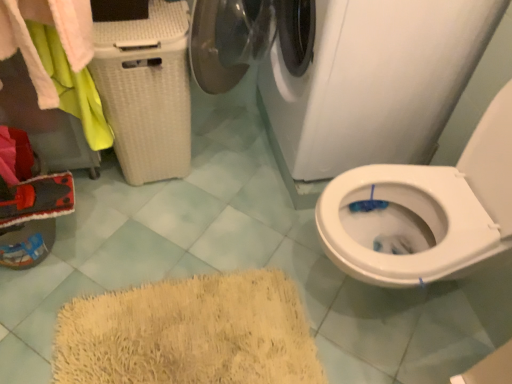
Question: From a real-world perspective, is white glossy washing machine at upper center physically below white wicker laundry basket at left?

Choices:
 (A) yes
 (B) no

Answer: (A)

Question: Is white glossy washing machine at upper center at the right side of white wicker laundry basket at left?

Choices:
 (A) no
 (B) yes

Answer: (B)

Question: Is white glossy washing machine at upper center aimed at white wicker laundry basket at left?

Choices:
 (A) no
 (B) yes

Answer: (B)

Question: Is white glossy washing machine at upper center positioned beyond the bounds of white wicker laundry basket at left?

Choices:
 (A) no
 (B) yes

Answer: (B)

Question: From a real-world perspective, does white glossy washing machine at upper center stand above white wicker laundry basket at left?

Choices:
 (A) yes
 (B) no

Answer: (B)

Question: From a real-world perspective, is white wicker laundry basket at left above or below white glossy washing machine at upper center?

Choices:
 (A) below
 (B) above

Answer: (A)

Question: From the image's perspective, is white wicker laundry basket at left positioned above or below white glossy washing machine at upper center?

Choices:
 (A) above
 (B) below

Answer: (B)

Question: Considering the positions of white wicker laundry basket at left and white glossy washing machine at upper center in the image, is white wicker laundry basket at left taller or shorter than white glossy washing machine at upper center?

Choices:
 (A) short
 (B) tall

Answer: (A)

Question: Is white wicker laundry basket at left inside or outside of white glossy washing machine at upper center?

Choices:
 (A) outside
 (B) inside

Answer: (A)

Question: From their relative heights in the image, would you say white wicker laundry basket at left is taller or shorter than white wicker laundry basket at left?

Choices:
 (A) short
 (B) tall

Answer: (A)

Question: Based on their sizes in the image, would you say white wicker laundry basket at left is bigger or smaller than white wicker laundry basket at left?

Choices:
 (A) big
 (B) small

Answer: (B)

Question: Would you say white wicker laundry basket at left is to the left or to the right of white wicker laundry basket at left in the picture?

Choices:
 (A) right
 (B) left

Answer: (B)

Question: Is point (32, 11) closer or farther from the camera than point (159, 89)?

Choices:
 (A) closer
 (B) farther

Answer: (A)

Question: From the image's perspective, is white glossy washing machine at upper center above or below white wicker laundry basket at left?

Choices:
 (A) above
 (B) below

Answer: (A)

Question: Considering their positions, is white glossy washing machine at upper center located in front of or behind white wicker laundry basket at left?

Choices:
 (A) front
 (B) behind

Answer: (A)